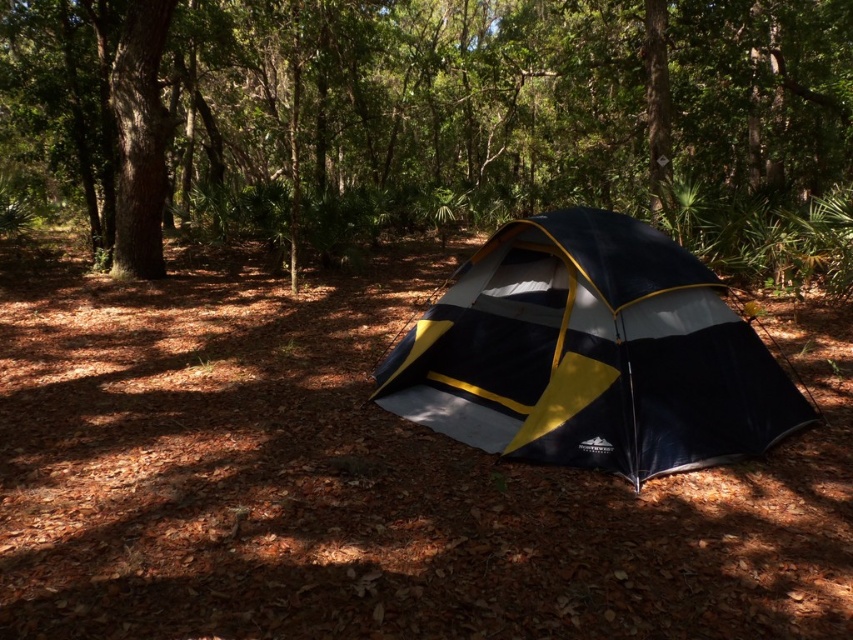
You are standing at the point marked as point [436,120] in the forest scene. What do you see directly in front of you?

You see a green leafy tree at center directly in front of you at point [436,120].